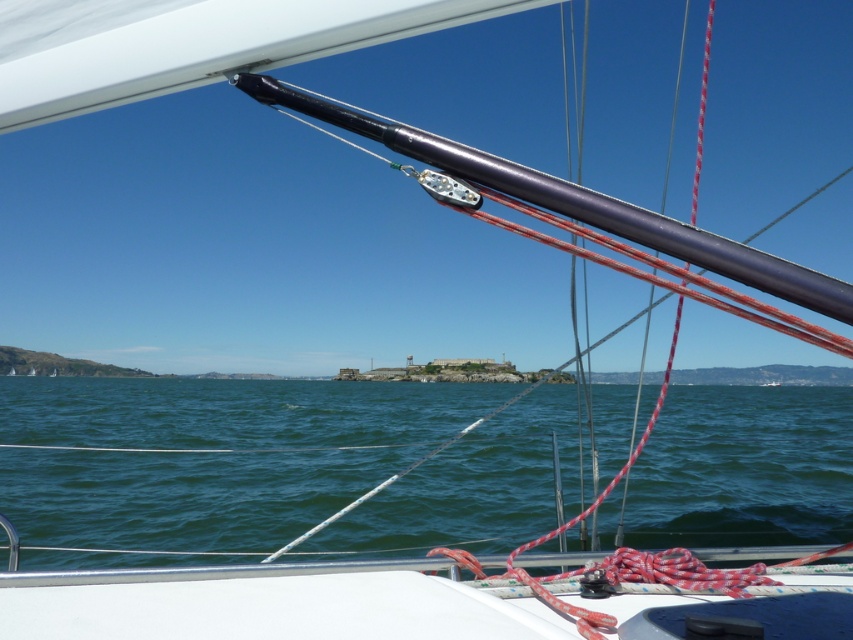
Question: Can you confirm if green water at center is positioned below polished metal mast at upper center?

Choices:
 (A) yes
 (B) no

Answer: (A)

Question: Which object appears closest to the camera in this image?

Choices:
 (A) green water at center
 (B) polished metal mast at upper center

Answer: (B)

Question: Does green water at center have a larger size compared to polished metal mast at upper center?

Choices:
 (A) no
 (B) yes

Answer: (B)

Question: Does green water at center come in front of polished metal mast at upper center?

Choices:
 (A) yes
 (B) no

Answer: (B)

Question: Which point appears closest to the camera in this image?

Choices:
 (A) (514, 438)
 (B) (579, 220)

Answer: (B)

Question: Which point is farther to the camera?

Choices:
 (A) polished metal mast at upper center
 (B) green water at center

Answer: (B)